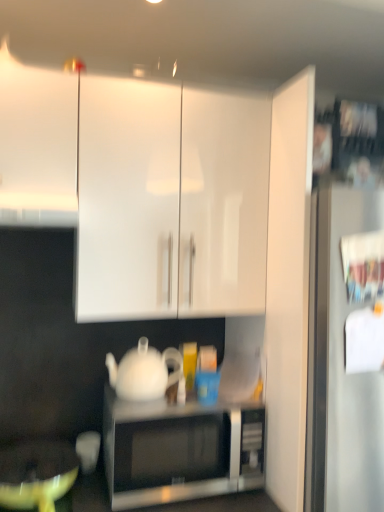
This screenshot has height=512, width=384. Find the location of `blank space above sleek silver microwave at center (from a real-world perspective)`. blank space above sleek silver microwave at center (from a real-world perspective) is located at coordinates (195, 391).